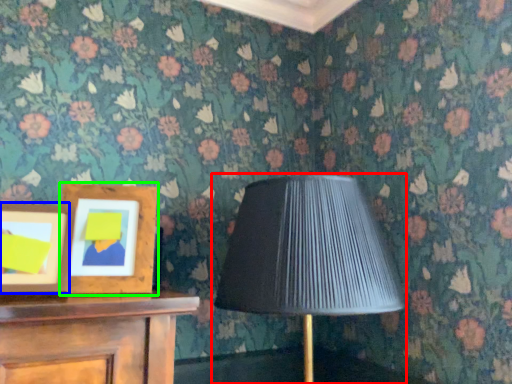
Question: Which is nearer to the lamp (highlighted by a red box)? picture frame (highlighted by a blue box) or picture frame (highlighted by a green box).

Choices:
 (A) picture frame
 (B) picture frame

Answer: (B)